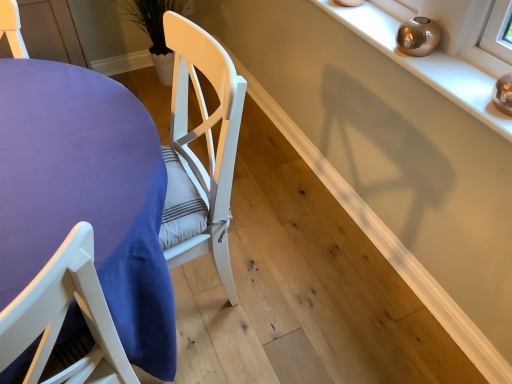
Question: From the image's perspective, relative to metallic gold orb at upper right, is purple fabric table at lower left above or below?

Choices:
 (A) above
 (B) below

Answer: (B)

Question: Relative to metallic gold orb at upper right, is purple fabric table at lower left in front or behind?

Choices:
 (A) front
 (B) behind

Answer: (A)

Question: From a real-world perspective, is purple fabric table at lower left physically located above or below metallic gold orb at upper right?

Choices:
 (A) above
 (B) below

Answer: (B)

Question: Looking at the image, does metallic gold orb at upper right seem bigger or smaller compared to purple fabric table at lower left?

Choices:
 (A) small
 (B) big

Answer: (A)

Question: Considering the positions of point (432, 67) and point (50, 200), is point (432, 67) closer or farther from the camera than point (50, 200)?

Choices:
 (A) farther
 (B) closer

Answer: (A)

Question: Would you say metallic gold orb at upper right is to the left or to the right of purple fabric table at lower left in the picture?

Choices:
 (A) left
 (B) right

Answer: (B)

Question: Would you say metallic gold orb at upper right is inside or outside purple fabric table at lower left?

Choices:
 (A) inside
 (B) outside

Answer: (B)